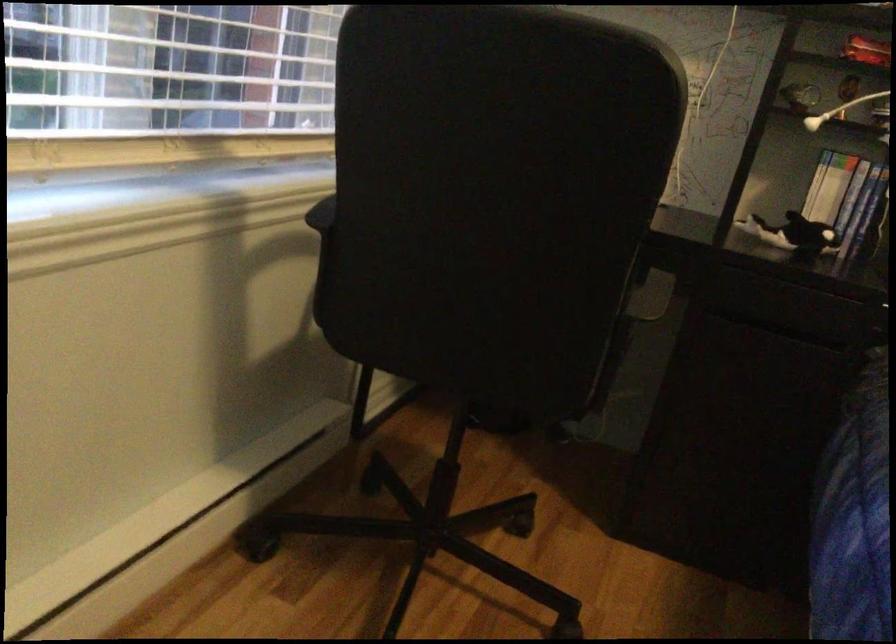
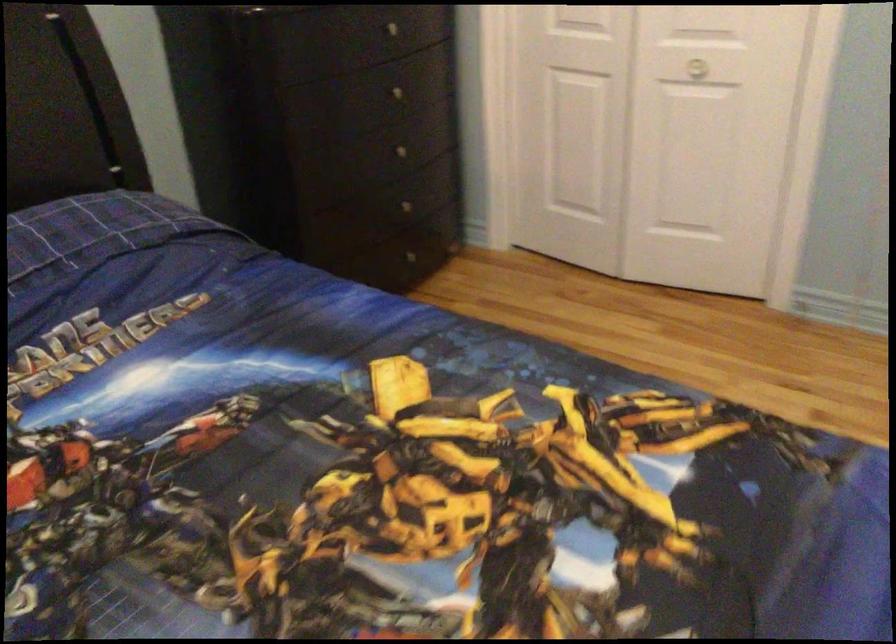
How did the camera likely rotate?

The camera's rotation is toward right-down.